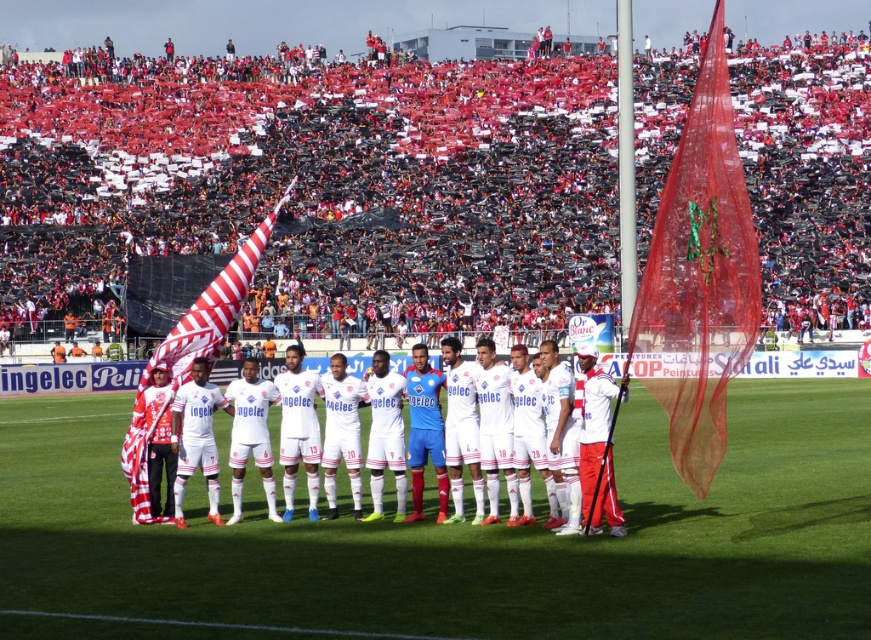
You are a photographer positioned at the edge of the soccer field. You want to capture a photo where both the green grass football field at center and the striped fabric flag at center are clearly visible. Based on their positions, which object should appear higher in the photo?

The striped fabric flag at center should appear higher in the photo because the green grass football field at center is located below it.

You are a photographer at the soccer stadium and want to take a photo of both the point at coordinates point (692, 380) and point (228, 269). Which point should you focus on first to ensure both are in focus?

You should focus on point (692, 380) first because it is closer to the camera than point (228, 269). By focusing on the closer point, the depth of field may extend to include the farther point in focus as well.

You are a photographer at the soccer stadium. You need to capture a photo that includes both the translucent red flag at right and the striped fabric flag at center. Which flag should you position closer to the camera to ensure both are in focus?

The striped fabric flag at center should be positioned closer to the camera because the translucent red flag at right is above it, so adjusting the focus to the closer flag will keep both in focus.